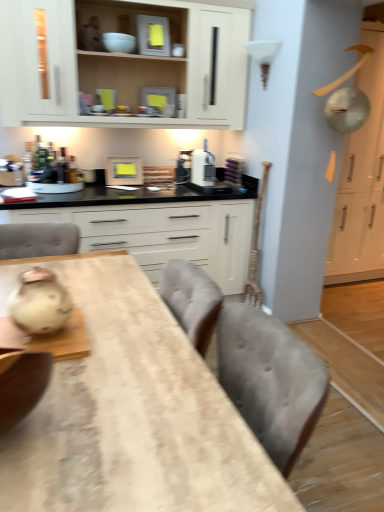
Question: From the image's perspective, is white glossy cabinet at upper right, the first cabinetry from the right, above or below white matte cabinet at center, the first cabinetry from the left?

Choices:
 (A) below
 (B) above

Answer: (B)

Question: Considering the positions of white glossy cabinet at upper right, the first cabinetry from the right, and white matte cabinet at center, the first cabinetry from the left, in the image, is white glossy cabinet at upper right, the first cabinetry from the right, wider or thinner than white matte cabinet at center, the first cabinetry from the left,?

Choices:
 (A) thin
 (B) wide

Answer: (B)

Question: Which is nearer to the white matte cabinet at upper center, the 2th cabinetry when ordered from right to left?

Choices:
 (A) matte gray toaster at upper center, positioned as the 1th appliance in front-to-back order
 (B) wooden frame at upper center, the 1th appliance from the back
 (C) metallic silver toaster at upper center, the second appliance in the bottom-to-top sequence
 (D) white glossy cabinet at upper right, the first cabinetry from the right
 (E) wooden table at center

Answer: (A)

Question: Which is nearer to the white matte cabinet at center, acting as the 3th cabinetry starting from the right?

Choices:
 (A) metallic silver toaster at upper center, which is counted as the 2th appliance, starting from the back
 (B) matte gray toaster at upper center, which is counted as the 3th appliance, starting from the back
 (C) wooden table at center
 (D) white matte cabinet at upper center, the 2th cabinetry when ordered from right to left
 (E) matte white ceramic tea pot at left

Answer: (D)